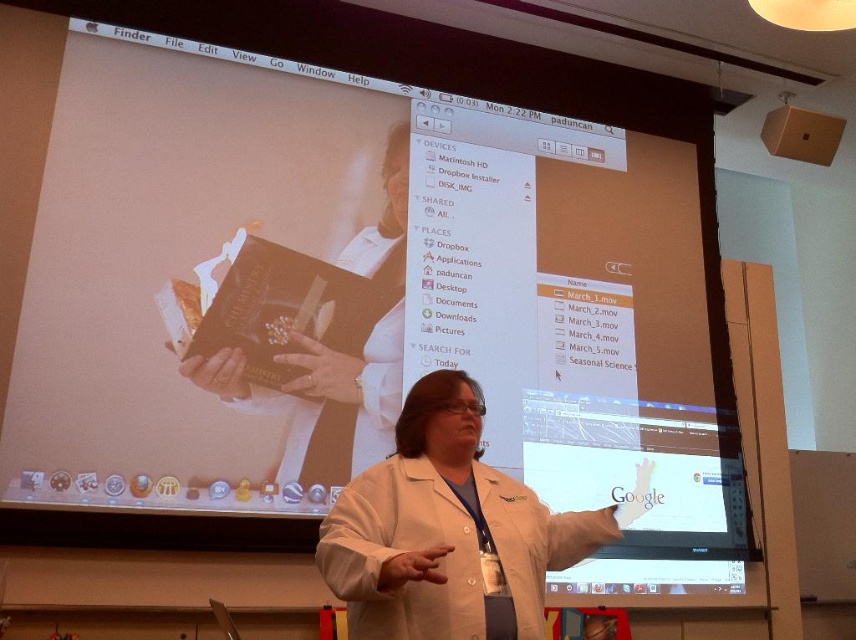
You are a virtual assistant in a presentation. You need to highlight two points on the projection screen. The first point is at coordinates point (424,380) and the second is at point (342,444). Which of these points appears closer to the audience?

Point (424,380) is closer to the camera than point (342,444), so it will appear closer to the audience.